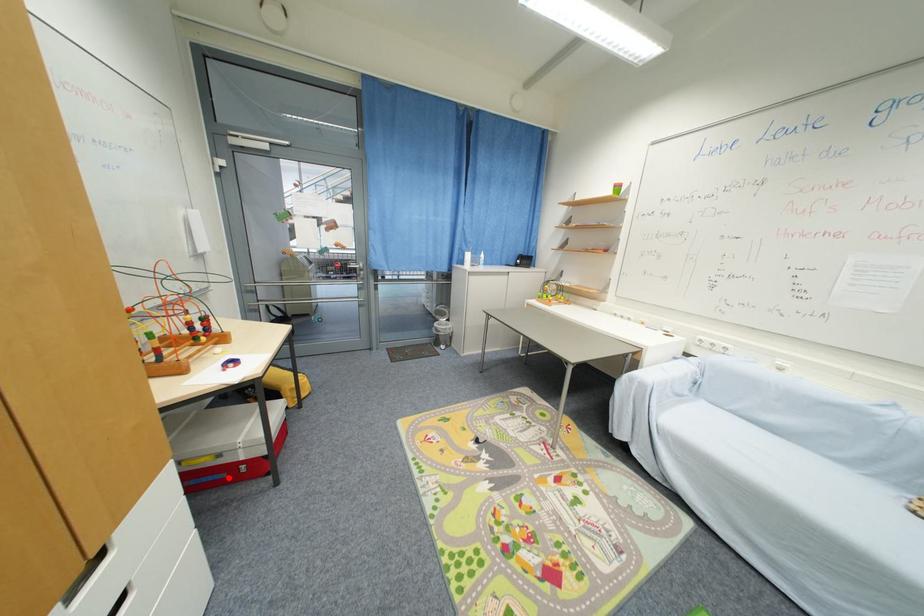
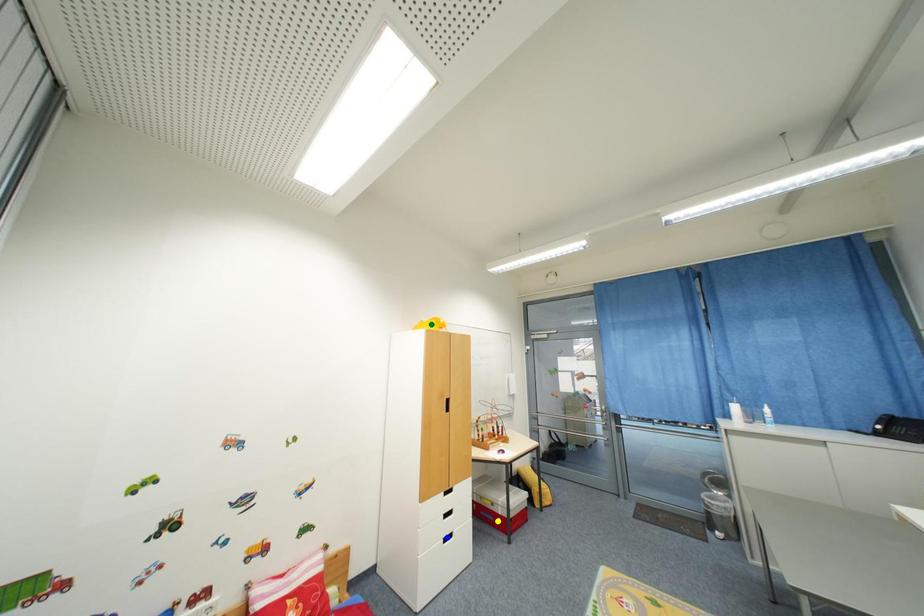
Question: I am providing you with two images of the same scene from different viewpoints. A red point is marked on the first image. You are given multiple points on the second image. Can you choose the point in image 2 that corresponds to the point in image 1?

Choices:
 (A) yellow point
 (B) green point
 (C) blue point

Answer: (A)